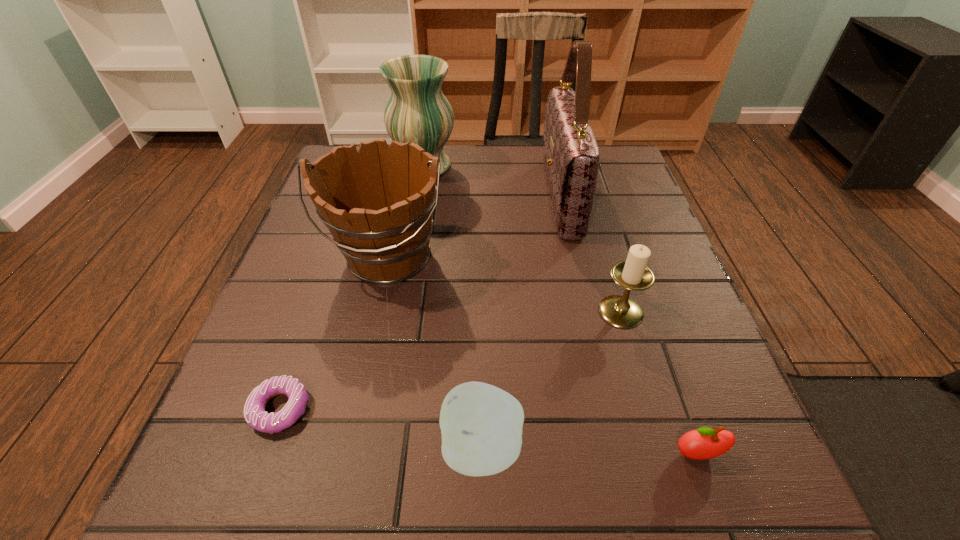
In the image, there is a desktop. Where is `vacant space at the near edge`? vacant space at the near edge is located at coordinates (588, 466).

This screenshot has height=540, width=960. What are the coordinates of `free region at the left edge of the desktop` in the screenshot? It's located at (325, 384).

Where is `free spot at the right edge of the desktop`? The height and width of the screenshot is (540, 960). free spot at the right edge of the desktop is located at coordinates (664, 266).

In the image, there is a desktop. Where is `free space at the far right corner`? The width and height of the screenshot is (960, 540). free space at the far right corner is located at coordinates (597, 185).

You are a GUI agent. You are given a task and a screenshot of the screen. Output one action in this format:
    pyautogui.click(x=<x>, y=<y>)
    Task: Click on the vacant position at the near right corner of the desktop
    This screenshot has width=960, height=540.
    Given the screenshot: What is the action you would take?
    pos(714,463)

Where is `vacant space that is in between the left apple and the tallest object`? This screenshot has width=960, height=540. vacant space that is in between the left apple and the tallest object is located at coordinates (521, 322).

I want to click on empty space between the wine bucket and the sixth tallest object, so 542,356.

Locate an element on the screen. This screenshot has width=960, height=540. free spot between the tallest object and the candle holder is located at coordinates coord(590,254).

I want to click on vacant region between the vase and the doughnut, so click(352, 287).

Find the location of a particular element. The image size is (960, 540). vacant area that lies between the fourth object from right to left and the handbag is located at coordinates (521, 322).